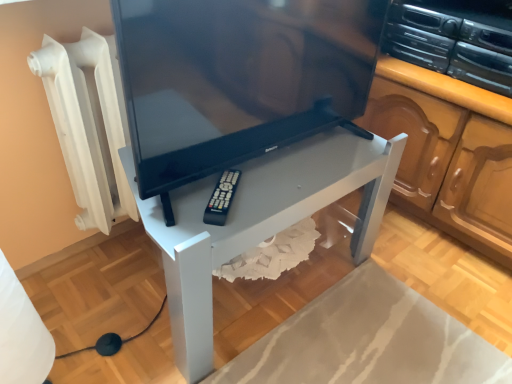
You are a GUI agent. You are given a task and a screenshot of the screen. Output one action in this format:
    pyautogui.click(x=<x>, y=<y>)
    Task: Click on the free space above black plastic stereo at upper right (from a real-world perspective)
    
    Given the screenshot: What is the action you would take?
    pyautogui.click(x=455, y=8)